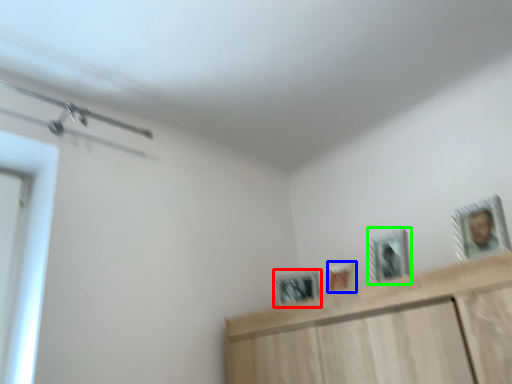
Question: Considering the real-world distances, which object is closest to picture frame (highlighted by a red box)? picture frame (highlighted by a blue box) or picture frame (highlighted by a green box).

Choices:
 (A) picture frame
 (B) picture frame

Answer: (A)